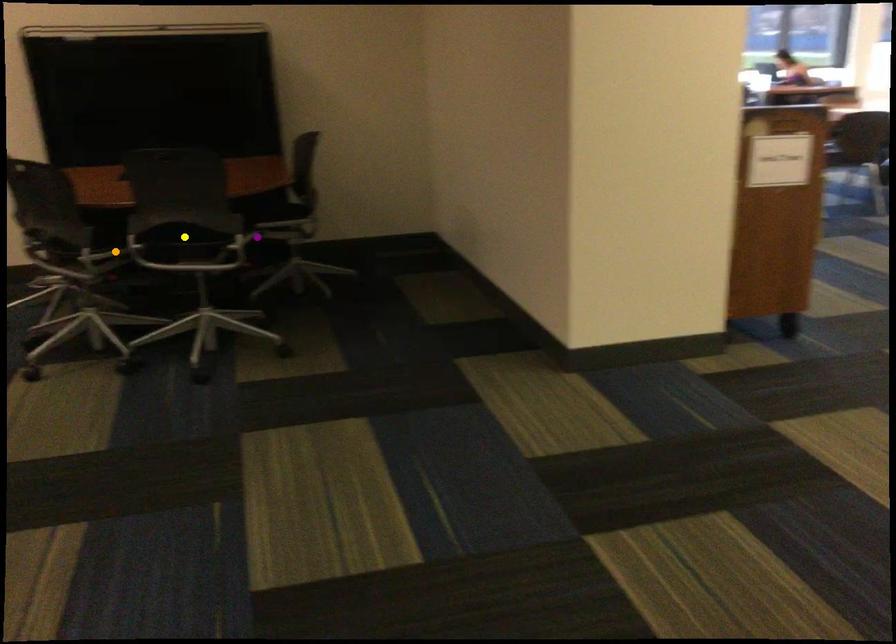
Order these from farthest to nearest:
A) orange point
B) purple point
C) yellow point

purple point
orange point
yellow point